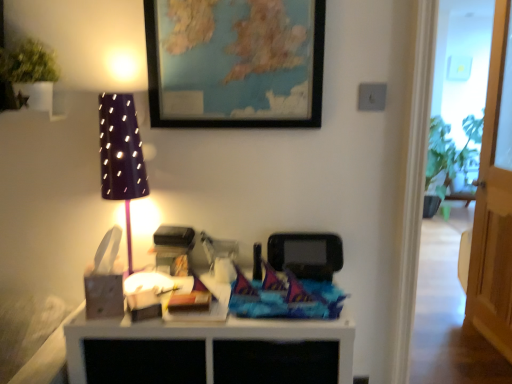
Question: Can you confirm if transparent wooden door at right is positioned to the right of matte black lampshade at left?

Choices:
 (A) no
 (B) yes

Answer: (B)

Question: From the image's perspective, is transparent wooden door at right located beneath matte black lampshade at left?

Choices:
 (A) yes
 (B) no

Answer: (B)

Question: Does transparent wooden door at right come in front of matte black lampshade at left?

Choices:
 (A) no
 (B) yes

Answer: (A)

Question: Would you say transparent wooden door at right is a long distance from matte black lampshade at left?

Choices:
 (A) no
 (B) yes

Answer: (B)

Question: Considering the relative sizes of transparent wooden door at right and matte black lampshade at left in the image provided, is transparent wooden door at right thinner than matte black lampshade at left?

Choices:
 (A) no
 (B) yes

Answer: (B)

Question: Is matte black lampshade at left surrounded by transparent wooden door at right?

Choices:
 (A) no
 (B) yes

Answer: (A)

Question: Is transparent wooden door at right completely or partially inside matte black lampshade at left?

Choices:
 (A) no
 (B) yes

Answer: (A)

Question: Is matte black lampshade at left further to camera compared to transparent wooden door at right?

Choices:
 (A) no
 (B) yes

Answer: (A)

Question: Is the surface of matte black lampshade at left in direct contact with transparent wooden door at right?

Choices:
 (A) yes
 (B) no

Answer: (B)

Question: Is matte black lampshade at left to the right of transparent wooden door at right from the viewer's perspective?

Choices:
 (A) yes
 (B) no

Answer: (B)

Question: Is matte black lampshade at left facing away from transparent wooden door at right?

Choices:
 (A) no
 (B) yes

Answer: (A)

Question: Is matte black lampshade at left positioned in front of transparent wooden door at right?

Choices:
 (A) no
 (B) yes

Answer: (B)

Question: Is green matte plant at upper left positioned with its back to transparent wooden door at right?

Choices:
 (A) no
 (B) yes

Answer: (A)